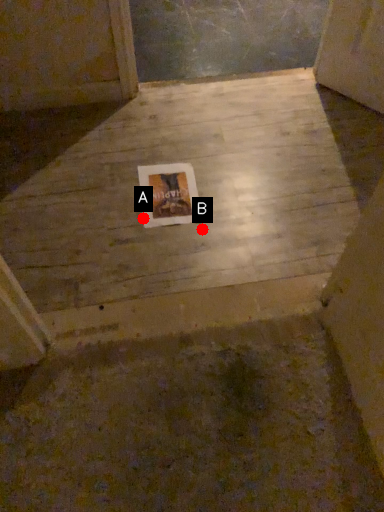
Question: Two points are circled on the image, labeled by A and B beside each circle. Which point is farther to the camera?

Choices:
 (A) A is further
 (B) B is further

Answer: (A)